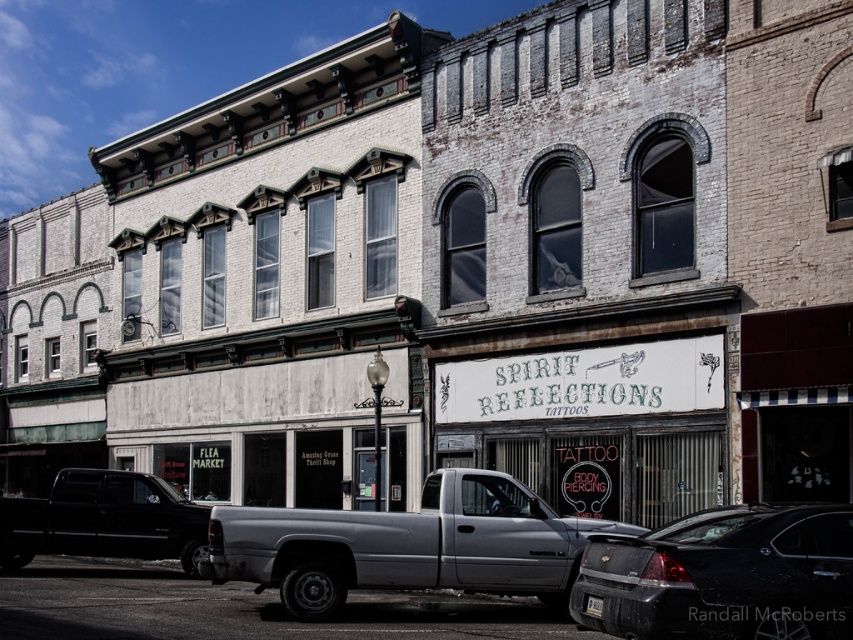
You are a delivery person trying to park your truck between the silver metallic truck at center and the matte black truck at lower left. Based on their positions, which truck should you position your truck closer to in order to park between them?

Since the silver metallic truck at center is closer to the viewer than the matte black truck at lower left, you should position your truck closer to the matte black truck at lower left to park between them.

You are driving a car and want to park in the space between the black glossy sedan at lower right and the matte black truck at lower left. Can you fit your car there if the space between them is 2 meters wide?

The space between the black glossy sedan at lower right and the matte black truck at lower left is 2 meters wide, so yes, you can fit your car there as it is wider than the average car width of 1.8 meters.

You are a pedestrian standing at the intersection near the Spirit Reflections Tattoos building. You see a silver metallic truck at center and a black glossy sedan at lower right. Which vehicle is closer to you?

The silver metallic truck at center is closer to you because it is positioned over the black glossy sedan at lower right, meaning it is in front of it from your perspective.